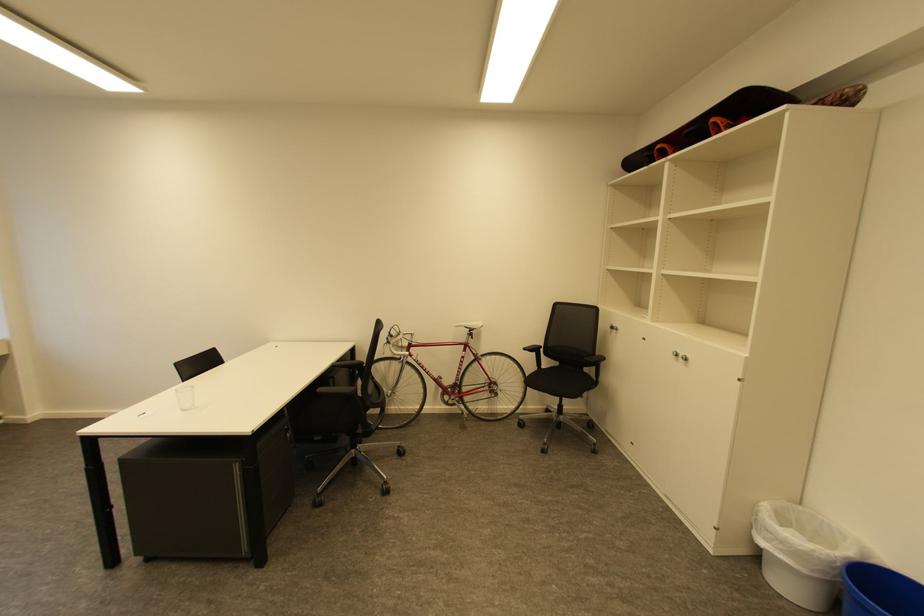
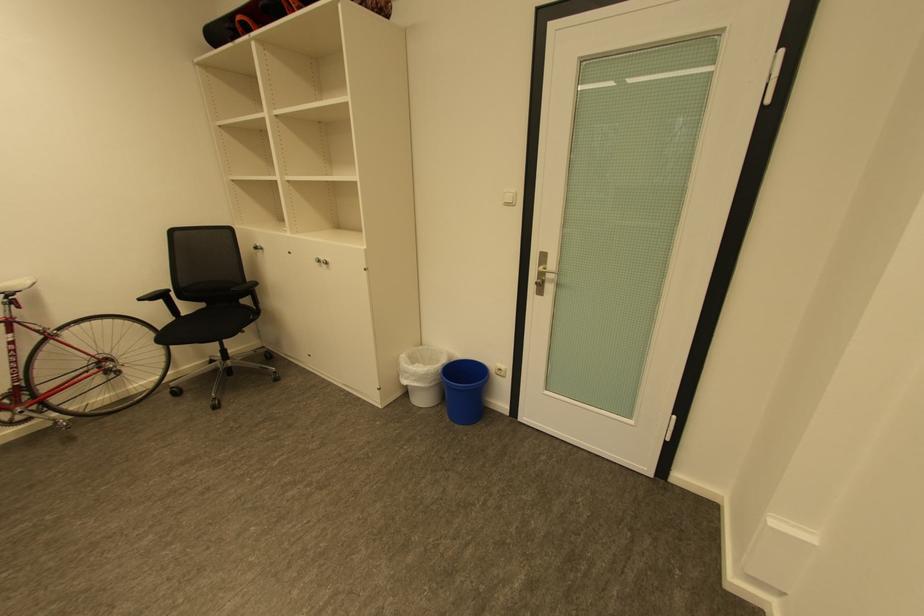
Find the pixel in the second image that matches point 531,350 in the first image.

(148, 300)